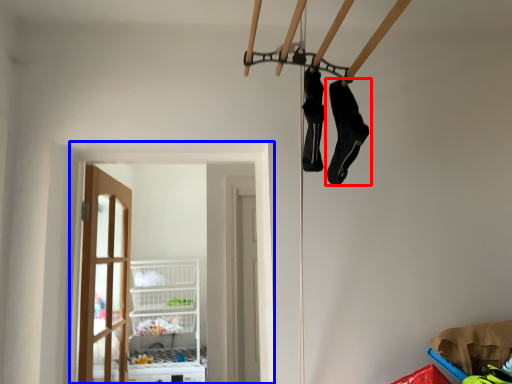
Question: Which object appears farthest to the camera in this image, footwear (highlighted by a red box) or window (highlighted by a blue box)?

Choices:
 (A) footwear
 (B) window

Answer: (B)